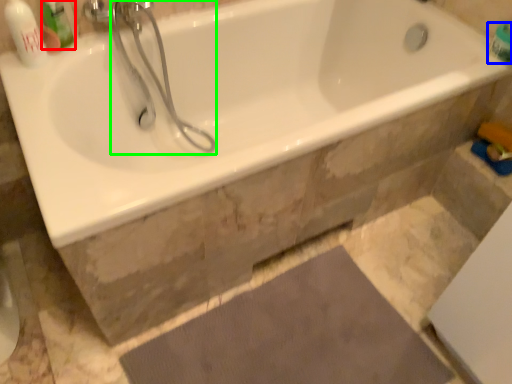
Question: Based on their relative distances, which object is nearer to mouthwash (highlighted by a red box)? Choose from toiletry (highlighted by a blue box) and shower (highlighted by a green box).

Choices:
 (A) toiletry
 (B) shower

Answer: (B)